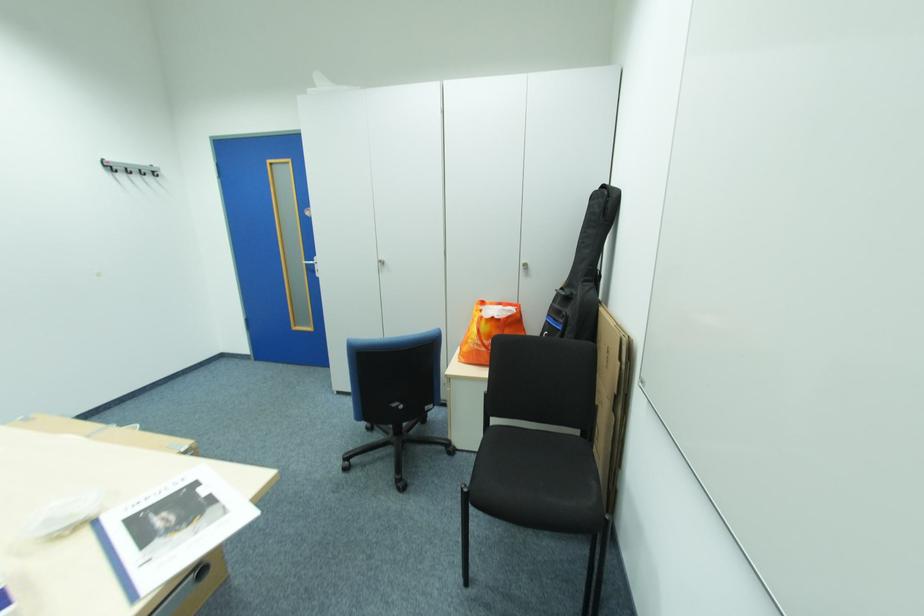
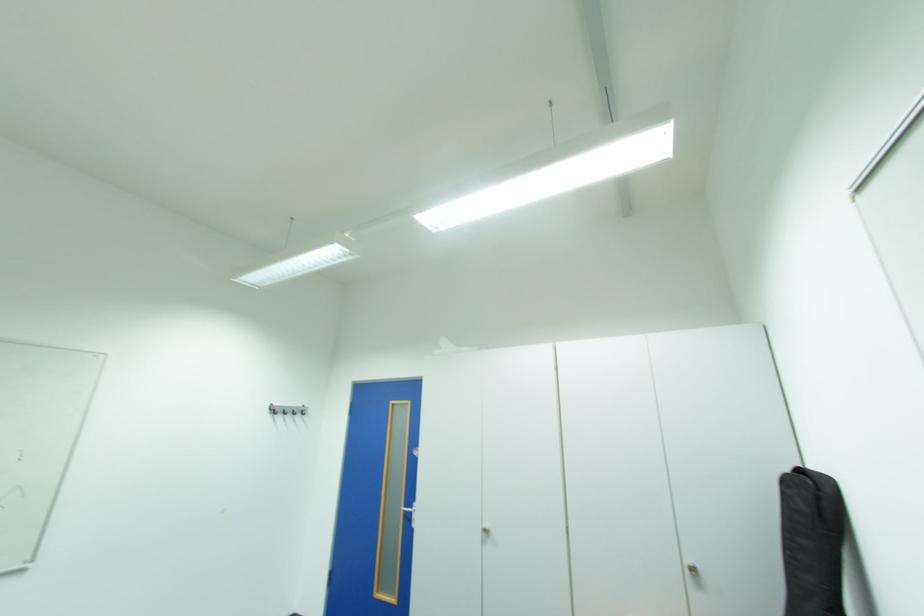
The point at (314, 265) is marked in the first image. Where is the corresponding point in the second image?

(414, 511)